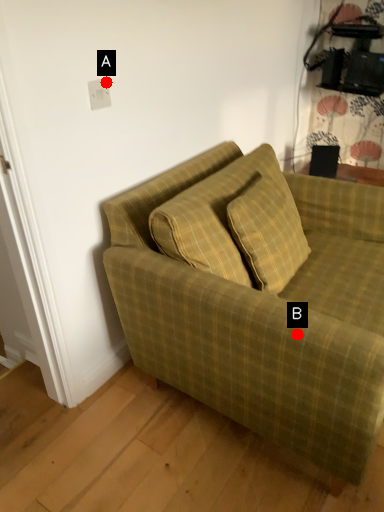
Question: Two points are circled on the image, labeled by A and B beside each circle. Which point appears closest to the camera in this image?

Choices:
 (A) A is closer
 (B) B is closer

Answer: (B)